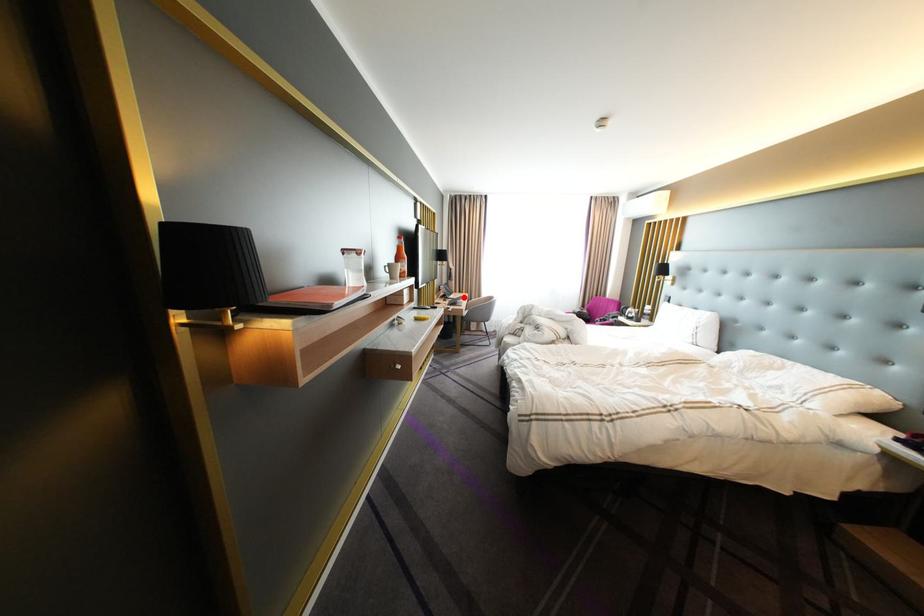
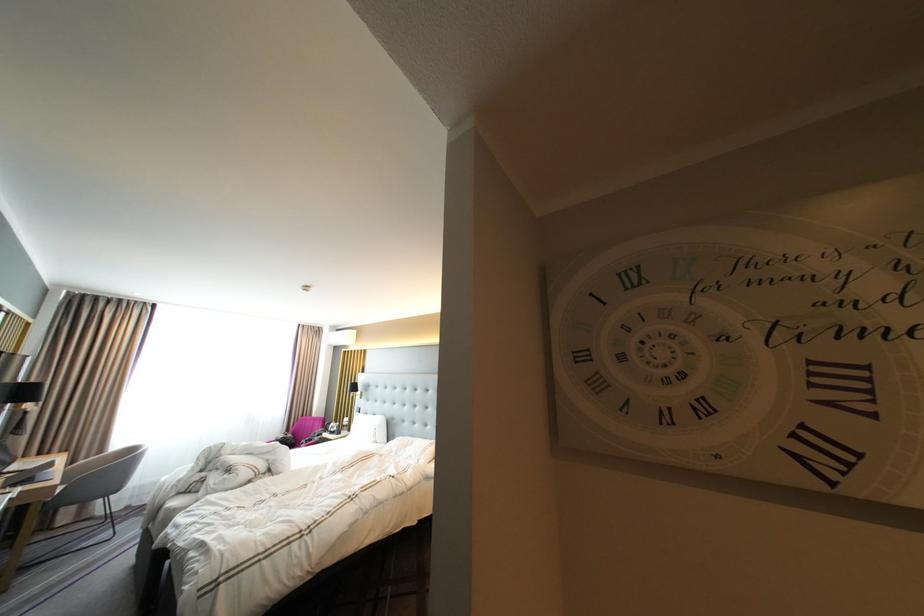
Question: I am providing you with two images of the same scene from different viewpoints. Image1 has a red point marked. In image2, the corresponding 3D location appears at what relative position? Reply with the corresponding letter.

Choices:
 (A) Closer
 (B) Farther

Answer: (B)